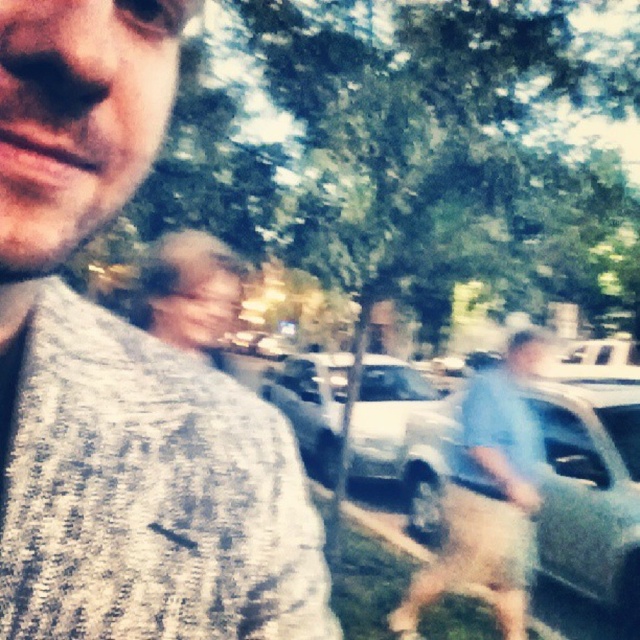
Is metallic silver car at center below blue fabric shirt at center?

Correct, metallic silver car at center is located below blue fabric shirt at center.

Who is higher up, metallic silver car at center or blue fabric shirt at center?

blue fabric shirt at center is above.

Is point (556, 557) positioned after point (420, 582)?

Yes.

Find the location of a particular element. The image size is (640, 640). metallic silver car at center is located at coordinates 592,490.

Which is more to the left, gray knitted sweater at left or metallic silver car at center?

gray knitted sweater at left is more to the left.

This screenshot has height=640, width=640. I want to click on gray knitted sweater at left, so 124,376.

Find the location of `gray knitted sweater at left`. gray knitted sweater at left is located at coordinates (124, 376).

Is gray knitted sweater at left thinner than blue fabric shirt at center?

Yes.

Does gray knitted sweater at left appear over blue fabric shirt at center?

Correct, gray knitted sweater at left is located above blue fabric shirt at center.

Is point (260, 422) in front of point (468, 458)?

Yes.

This screenshot has height=640, width=640. In order to click on gray knitted sweater at left in this screenshot , I will do `click(124, 376)`.